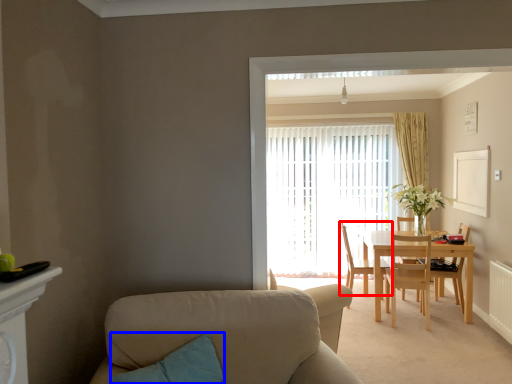
Question: Which object is further to the camera taking this photo, chair (highlighted by a red box) or pillow (highlighted by a blue box)?

Choices:
 (A) chair
 (B) pillow

Answer: (A)